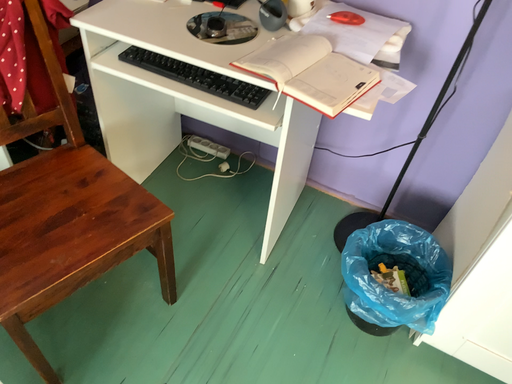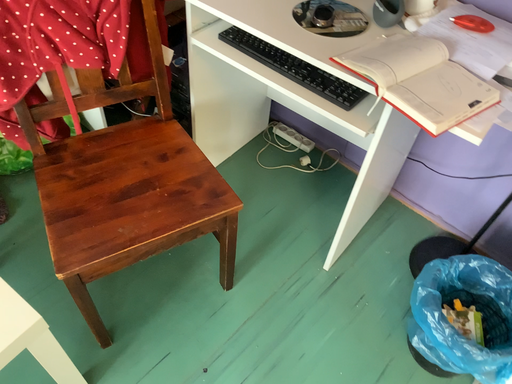
Question: Which way did the camera rotate in the video?

Choices:
 (A) rotated left
 (B) rotated right

Answer: (A)